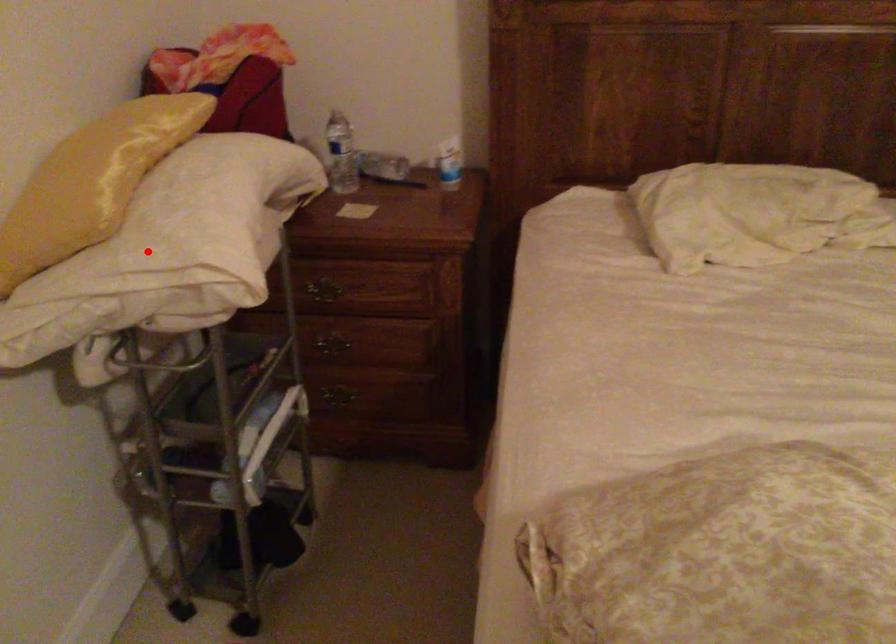
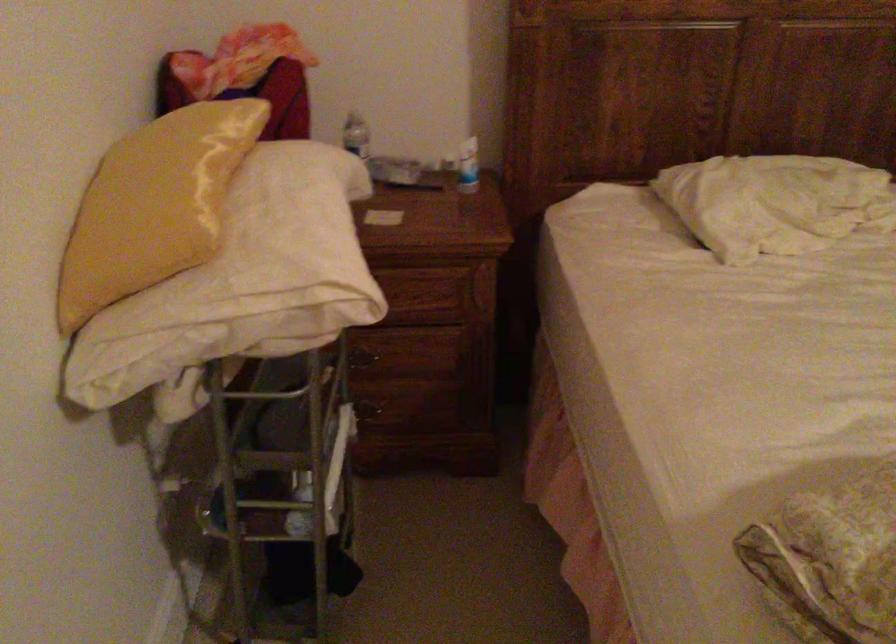
Question: I am providing you with two images of the same scene from different viewpoints. A red point is marked on the first image. Is the red point's position out of view in image 2?

Choices:
 (A) Yes
 (B) No

Answer: (B)